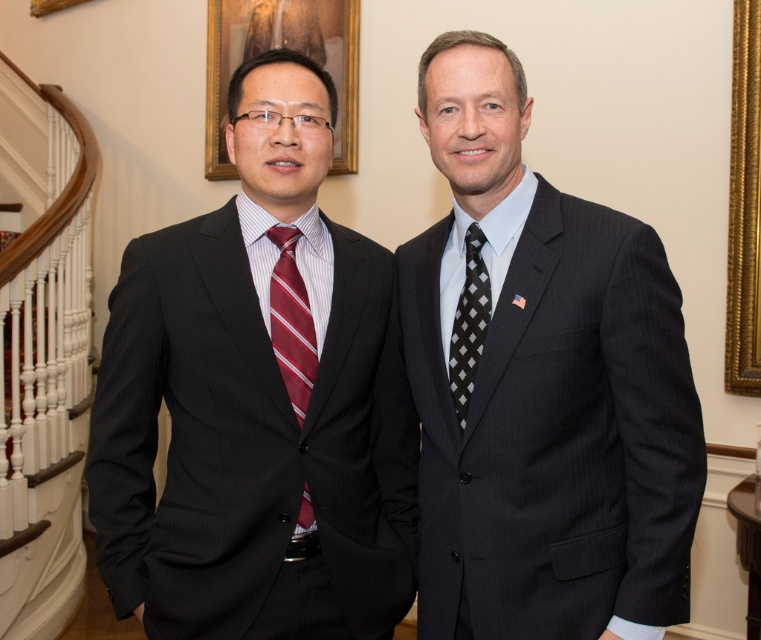
Question: Which is nearer to the matte gold picture frame at upper center?

Choices:
 (A) black checkered tie at right
 (B) black pinstripe suit at left

Answer: (B)

Question: Is black pinstripe suit at left smaller than matte gold picture frame at upper center?

Choices:
 (A) no
 (B) yes

Answer: (B)

Question: Among these objects, which one is farthest from the camera?

Choices:
 (A) striped silk tie at left
 (B) black pinstripe suit at left
 (C) matte gold picture frame at upper center

Answer: (C)

Question: In this image, where is black pinstripe suit at right located relative to black pinstripe suit at left?

Choices:
 (A) below
 (B) above

Answer: (B)

Question: Is black pinstripe suit at left smaller than matte gold picture frame at upper center?

Choices:
 (A) yes
 (B) no

Answer: (A)

Question: Which point is closer to the camera?

Choices:
 (A) (462, 401)
 (B) (447, 424)
 (C) (225, 289)
 (D) (322, 60)

Answer: (C)